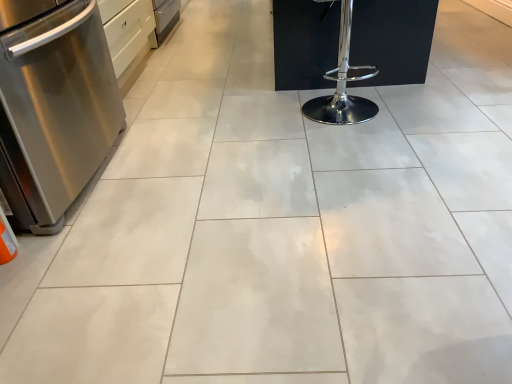
What do you see at coordinates (392, 39) in the screenshot? The height and width of the screenshot is (384, 512). I see `chrome/metallic bar stool at center-right` at bounding box center [392, 39].

Find the location of a particular element. Image resolution: width=512 pixels, height=384 pixels. chrome/metallic bar stool at center-right is located at coordinates (392, 39).

This screenshot has width=512, height=384. What do you see at coordinates (53, 106) in the screenshot? I see `stainless steel dishwasher at left` at bounding box center [53, 106].

Measure the distance between point (56, 97) and camera.

They are 5.60 feet apart.

Image resolution: width=512 pixels, height=384 pixels. I want to click on stainless steel dishwasher at left, so click(x=53, y=106).

Find the location of a particular element. chrome/metallic bar stool at center-right is located at coordinates (392, 39).

Consider the image. Visually, is stainless steel dishwasher at left positioned to the left or to the right of chrome/metallic bar stool at center-right?

In the image, stainless steel dishwasher at left appears on the left side of chrome/metallic bar stool at center-right.

Which is in front, stainless steel dishwasher at left or chrome/metallic bar stool at center-right?

Positioned in front is stainless steel dishwasher at left.

Based on the photo, which point is more forward, (x=60, y=113) or (x=413, y=58)?

Positioned in front is point (x=60, y=113).

From the image's perspective, who appears lower, stainless steel dishwasher at left or chrome/metallic bar stool at center-right?

stainless steel dishwasher at left.

From a real-world perspective, who is located lower, stainless steel dishwasher at left or chrome/metallic bar stool at center-right?

From a 3D spatial view, chrome/metallic bar stool at center-right is below.

Based on the photo, is stainless steel dishwasher at left wider than chrome/metallic bar stool at center-right?

Yes, stainless steel dishwasher at left is wider than chrome/metallic bar stool at center-right.

Is stainless steel dishwasher at left taller or shorter than chrome/metallic bar stool at center-right?

In the image, stainless steel dishwasher at left appears to be taller than chrome/metallic bar stool at center-right.

Considering the sizes of objects stainless steel dishwasher at left and chrome/metallic bar stool at center-right in the image provided, who is smaller, stainless steel dishwasher at left or chrome/metallic bar stool at center-right?

chrome/metallic bar stool at center-right.

Is stainless steel dishwasher at left spatially inside chrome/metallic bar stool at center-right, or outside of it?

stainless steel dishwasher at left is not enclosed by chrome/metallic bar stool at center-right.

Are stainless steel dishwasher at left and chrome/metallic bar stool at center-right beside each other?

stainless steel dishwasher at left and chrome/metallic bar stool at center-right are clearly separated.

Is stainless steel dishwasher at left looking in the opposite direction of chrome/metallic bar stool at center-right?

No, stainless steel dishwasher at left is not facing the opposite direction of chrome/metallic bar stool at center-right.

Where is `furniture located above the stainless steel dishwasher at left (from the image's perspective)`? furniture located above the stainless steel dishwasher at left (from the image's perspective) is located at coordinates (392, 39).

From the picture: Considering the relative positions of chrome/metallic bar stool at center-right and stainless steel dishwasher at left in the image provided, is chrome/metallic bar stool at center-right to the left or to the right of stainless steel dishwasher at left?

chrome/metallic bar stool at center-right is positioned on stainless steel dishwasher at left's right side.

Is the depth of chrome/metallic bar stool at center-right greater than that of stainless steel dishwasher at left?

Yes, chrome/metallic bar stool at center-right is further from the camera.

Is point (284, 36) less distant than point (94, 90)?

No, (284, 36) is behind (94, 90).

From the image's perspective, is chrome/metallic bar stool at center-right located beneath stainless steel dishwasher at left?

No.

From a real-world perspective, is chrome/metallic bar stool at center-right beneath stainless steel dishwasher at left?

Yes, from a real-world perspective, chrome/metallic bar stool at center-right is below stainless steel dishwasher at left.

Can you confirm if chrome/metallic bar stool at center-right is wider than stainless steel dishwasher at left?

No.

Who is shorter, chrome/metallic bar stool at center-right or stainless steel dishwasher at left?

chrome/metallic bar stool at center-right.

In the scene shown: Looking at the image, does chrome/metallic bar stool at center-right seem bigger or smaller compared to stainless steel dishwasher at left?

chrome/metallic bar stool at center-right is smaller than stainless steel dishwasher at left.

Which is correct: chrome/metallic bar stool at center-right is inside stainless steel dishwasher at left, or outside of it?

chrome/metallic bar stool at center-right is not inside stainless steel dishwasher at left, it's outside.

Is chrome/metallic bar stool at center-right placed right next to stainless steel dishwasher at left?

They are not placed beside each other.

Is chrome/metallic bar stool at center-right positioned with its back to stainless steel dishwasher at left?

No, chrome/metallic bar stool at center-right's orientation is not away from stainless steel dishwasher at left.

In the scene shown: What's the angular difference between chrome/metallic bar stool at center-right and stainless steel dishwasher at left's facing directions?

chrome/metallic bar stool at center-right and stainless steel dishwasher at left are facing 74.1 degrees away from each other.

This screenshot has width=512, height=384. I want to click on kitchen appliance below the chrome/metallic bar stool at center-right (from the image's perspective), so click(53, 106).

The image size is (512, 384). Find the location of `furniture directly beneath the stainless steel dishwasher at left (from a real-world perspective)`. furniture directly beneath the stainless steel dishwasher at left (from a real-world perspective) is located at coordinates (392, 39).

I want to click on furniture above the stainless steel dishwasher at left (from the image's perspective), so click(392, 39).